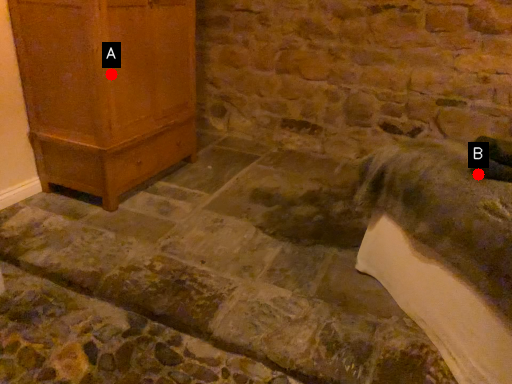
Question: Two points are circled on the image, labeled by A and B beside each circle. Which of the following is the closest to the observer?

Choices:
 (A) A is closer
 (B) B is closer

Answer: (B)